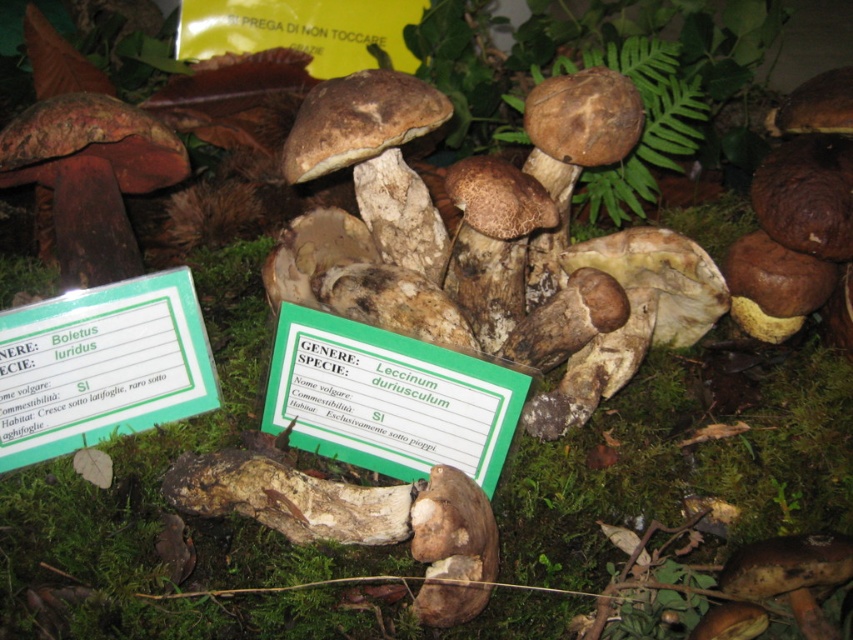
Based on the photo, is green paper sign at center behind green leafy fern at upper center?

That is False.

This screenshot has height=640, width=853. I want to click on green paper sign at center, so click(x=387, y=397).

Who is more forward, (181, 404) or (636, 49)?

Point (181, 404) is more forward.

Can you confirm if green paper sign at lower left is positioned to the right of green leafy fern at upper center?

In fact, green paper sign at lower left is to the left of green leafy fern at upper center.

Is point (163, 310) positioned after point (647, 152)?

No.

Identify the location of green paper sign at lower left. (102, 365).

Is green paper sign at center to the left of green paper sign at lower left from the viewer's perspective?

Incorrect, green paper sign at center is not on the left side of green paper sign at lower left.

From the picture: Between green paper sign at center and green paper sign at lower left, which one is positioned higher?

green paper sign at lower left is above.

Is point (469, 416) behind point (148, 355)?

No, it is in front of (148, 355).

Where is `green paper sign at center`? The height and width of the screenshot is (640, 853). green paper sign at center is located at coordinates (387, 397).